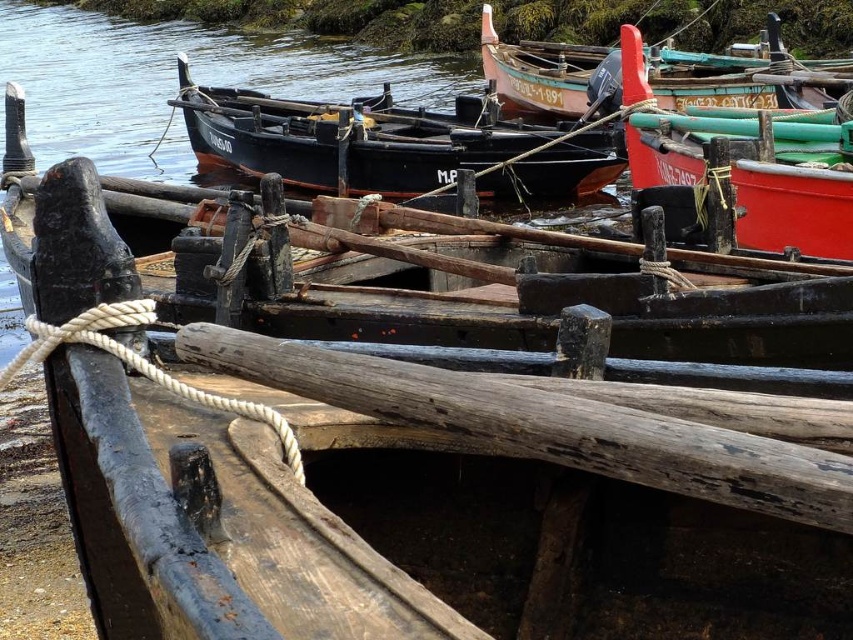
Is red matte boat at upper right taller than wooden boat at upper right?

Incorrect, red matte boat at upper right's height is not larger of wooden boat at upper right's.

Is red matte boat at upper right thinner than wooden boat at upper right?

Yes.

Does point (827, 193) lie behind point (660, 44)?

No, it is in front of (660, 44).

The width and height of the screenshot is (853, 640). What are the coordinates of `red matte boat at upper right` in the screenshot? It's located at (759, 170).

Measure the distance between matte black boat at center and camera.

14.77 meters

Between matte black boat at center and red matte boat at upper right, which one appears on the left side from the viewer's perspective?

From the viewer's perspective, matte black boat at center appears more on the left side.

At what (x,y) coordinates should I click in order to perform the action: click on matte black boat at center. Please return your answer as a coordinate pair (x, y). Looking at the image, I should click on (389, 145).

Does weathered wood log at center have a greater height compared to wooden boat at upper right?

No.

Which is more to the right, weathered wood log at center or wooden boat at upper right?

From the viewer's perspective, wooden boat at upper right appears more on the right side.

Does point (792, 520) lie behind point (682, 106)?

That is False.

The width and height of the screenshot is (853, 640). In order to click on weathered wood log at center in this screenshot , I will do [x=549, y=424].